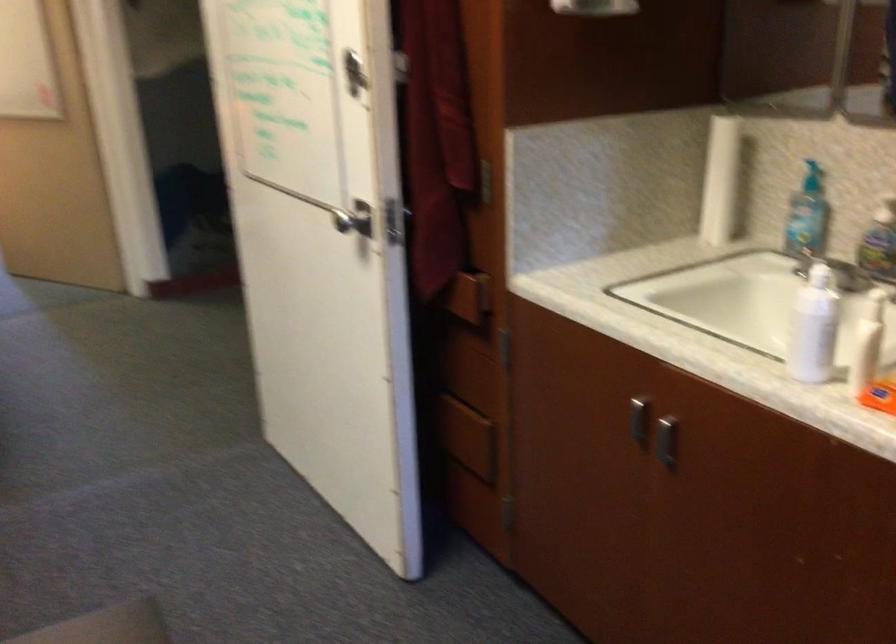
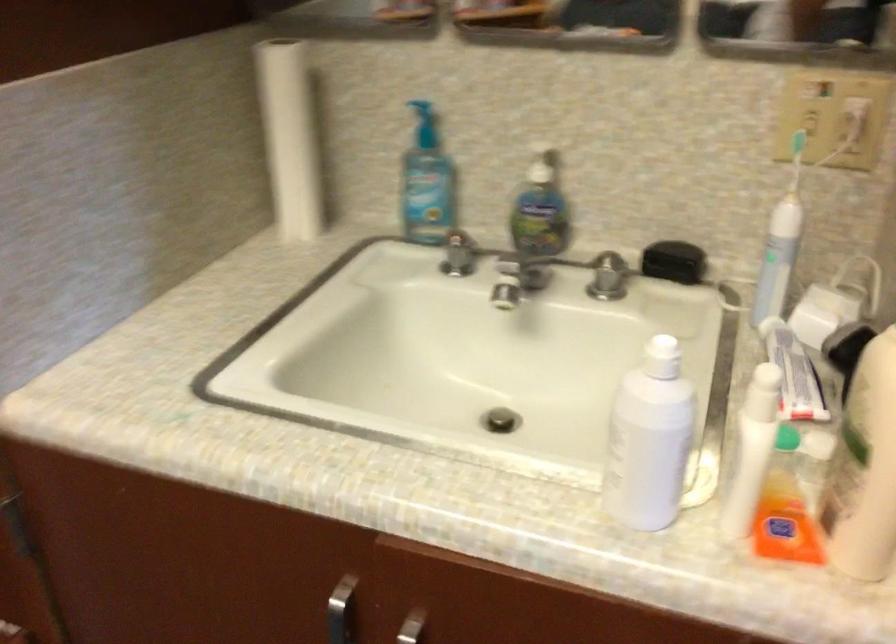
Where in the second image is the point corresponding to pixel 800 257 from the first image?

(458, 254)